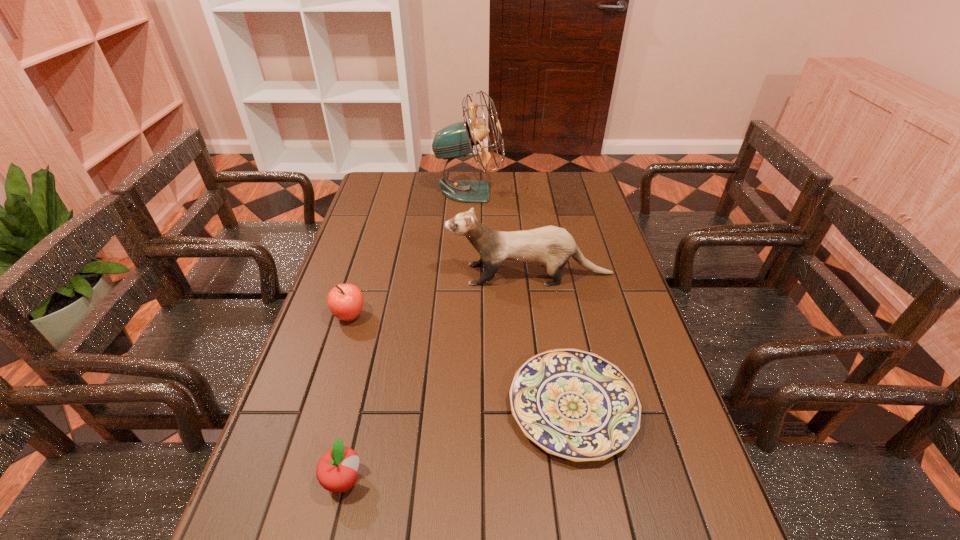
Image resolution: width=960 pixels, height=540 pixels. I want to click on free point between the shortest object and the farthest object, so click(521, 299).

Locate an element on the screen. The image size is (960, 540). object that ranks as the closest to the left apple is located at coordinates (551, 246).

Identify the location of the third closest object to the leftmost object. (573, 404).

This screenshot has height=540, width=960. I want to click on vacant point that satisfies the following two spatial constraints: 1. on the face of the second farthest object; 2. on the right side of the plate, so click(547, 406).

This screenshot has width=960, height=540. Find the location of `free space that satisfies the following two spatial constraints: 1. on the face of the ferret; 2. on the front side of the leftmost object`. free space that satisfies the following two spatial constraints: 1. on the face of the ferret; 2. on the front side of the leftmost object is located at coordinates (536, 316).

Locate an element on the screen. The image size is (960, 540). free region that satisfies the following two spatial constraints: 1. on the front side of the shortest object; 2. on the left side of the leftmost object is located at coordinates (322, 406).

Find the location of a particular element. The width and height of the screenshot is (960, 540). free space that satisfies the following two spatial constraints: 1. on the front-facing side of the fan for air flow; 2. on the back side of the shortest object is located at coordinates (462, 406).

Locate an element on the screen. Image resolution: width=960 pixels, height=540 pixels. vacant space that satisfies the following two spatial constraints: 1. on the front side of the second object from left to right; 2. on the left side of the left apple is located at coordinates (299, 481).